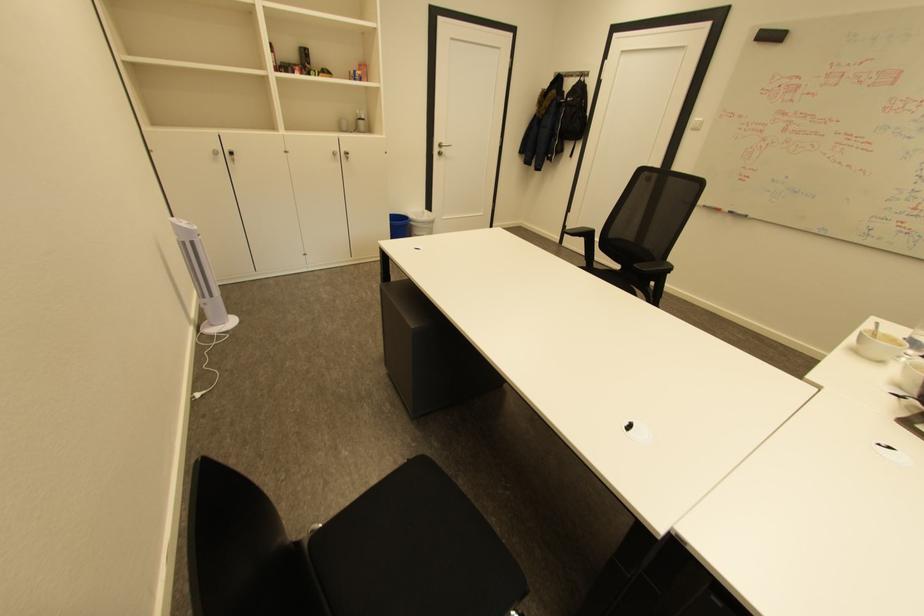
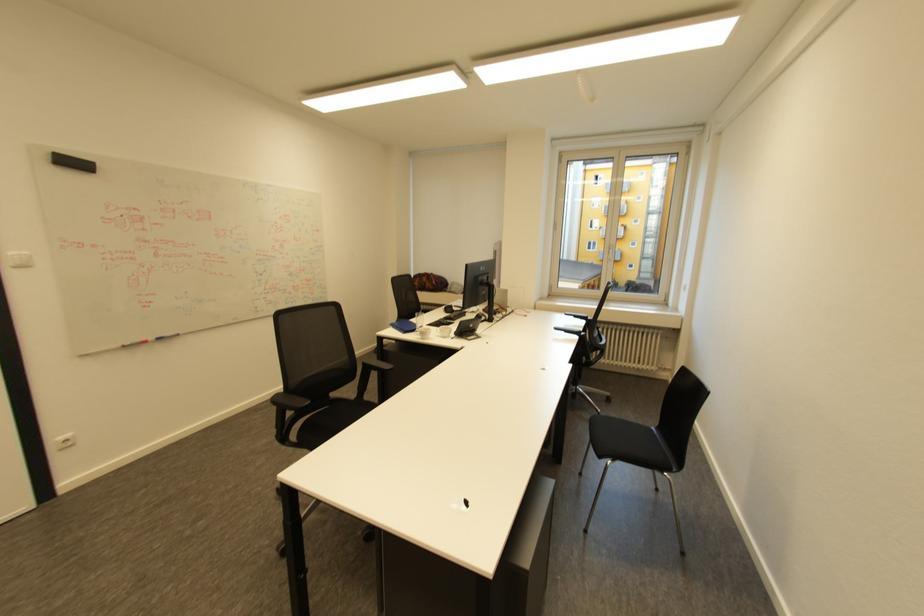
In the second image, find the point that corresponds to point (768, 30) in the first image.

(58, 153)